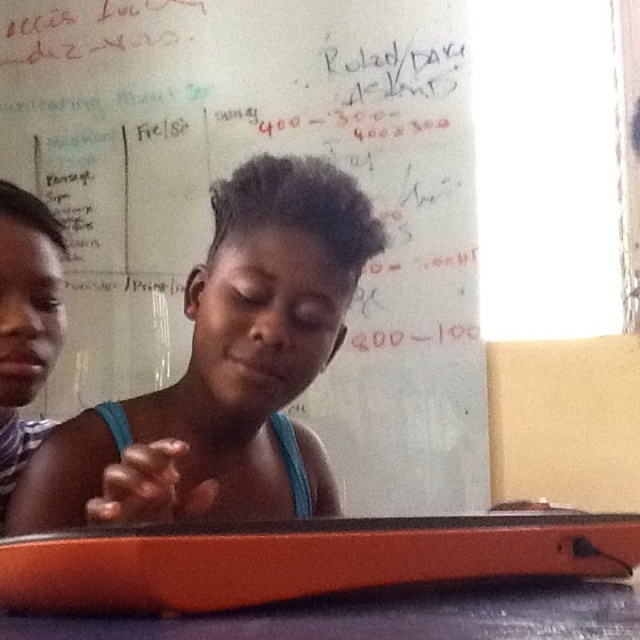
You are standing at the point with coordinates point (x=179, y=26). You want to walk to the point with coordinates point (x=451, y=604). Is there a clear path between the two points?

Point (x=179, y=26) is behind point (x=451, y=604), so there is a clear path between them.